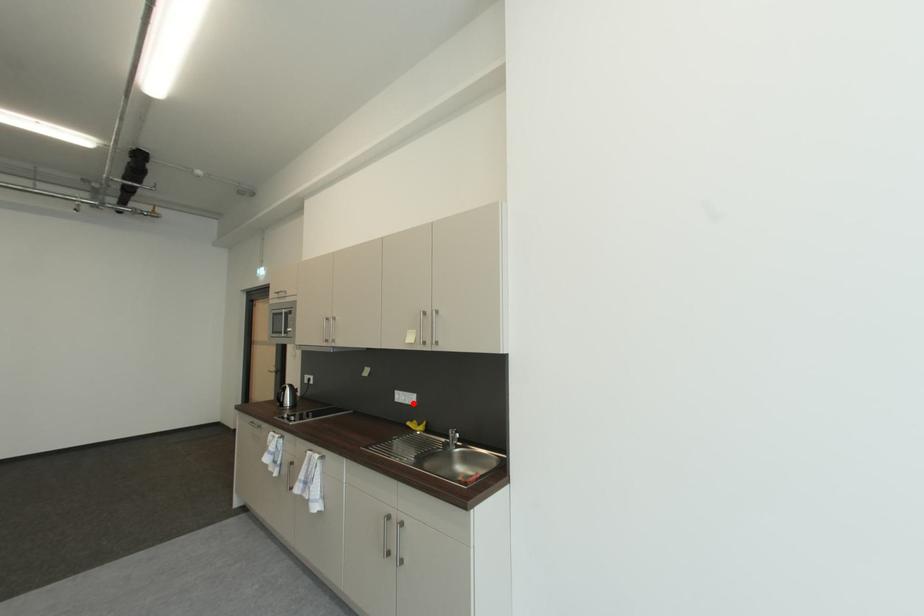
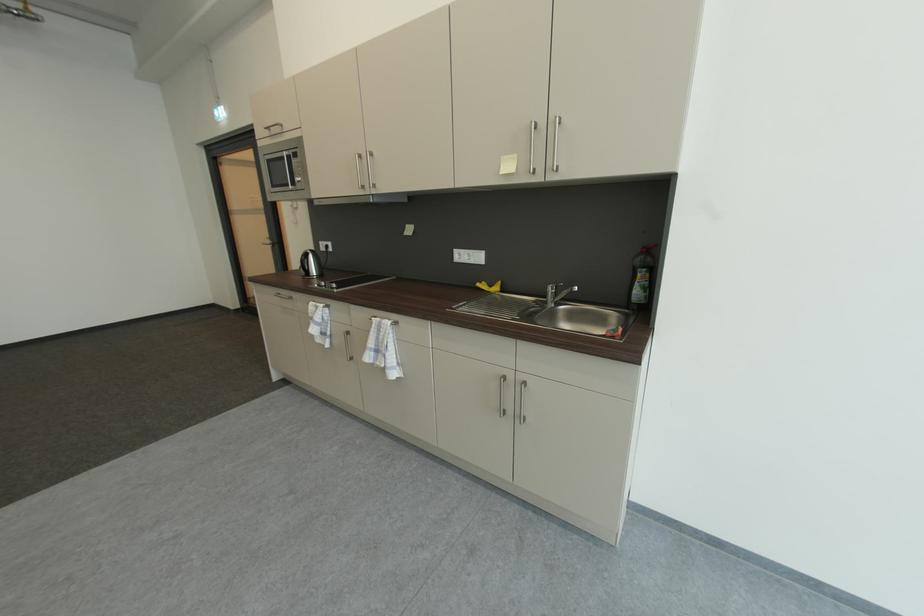
Locate, in the second image, the point that corresponds to the highlighted location in the first image.

(479, 262)